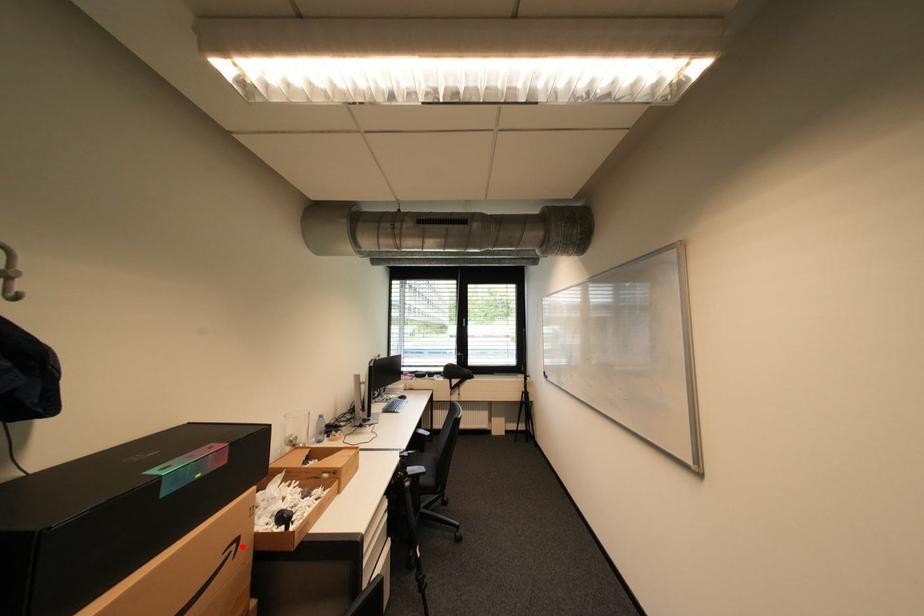
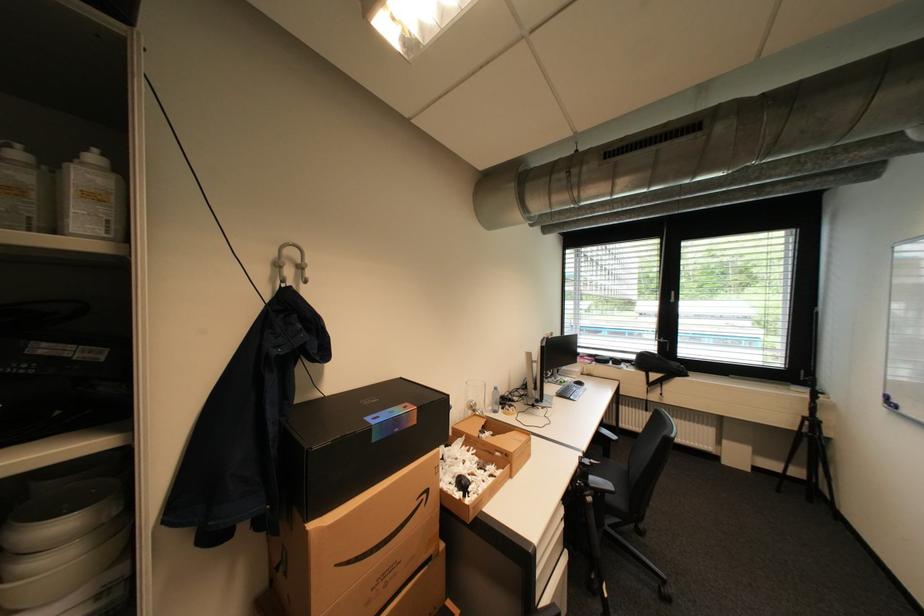
Question: I am providing you with two images of the same scene from different viewpoints. A red point is shown in image1. For the corresponding object point in image2, is it positioned nearer or farther from the camera?

Choices:
 (A) Nearer
 (B) Farther

Answer: (B)